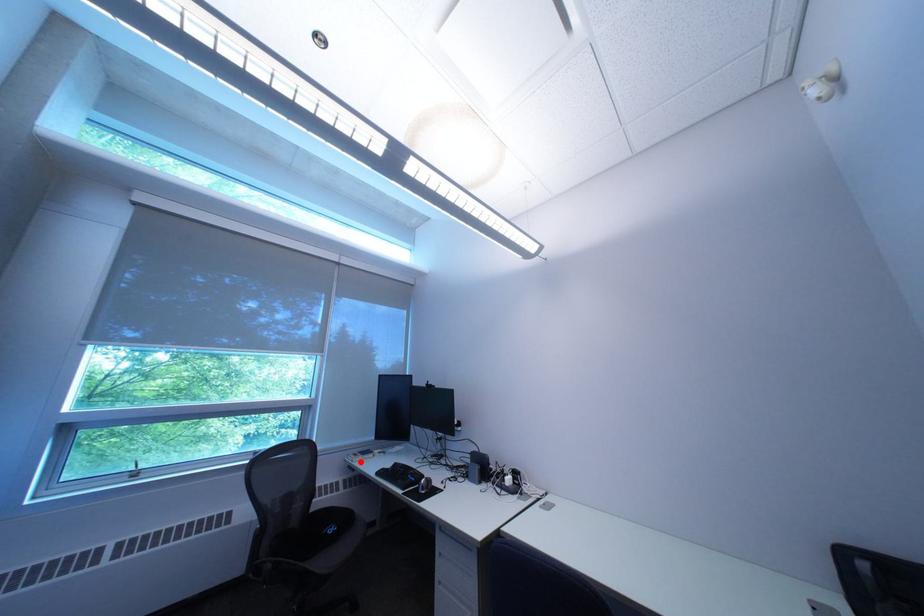
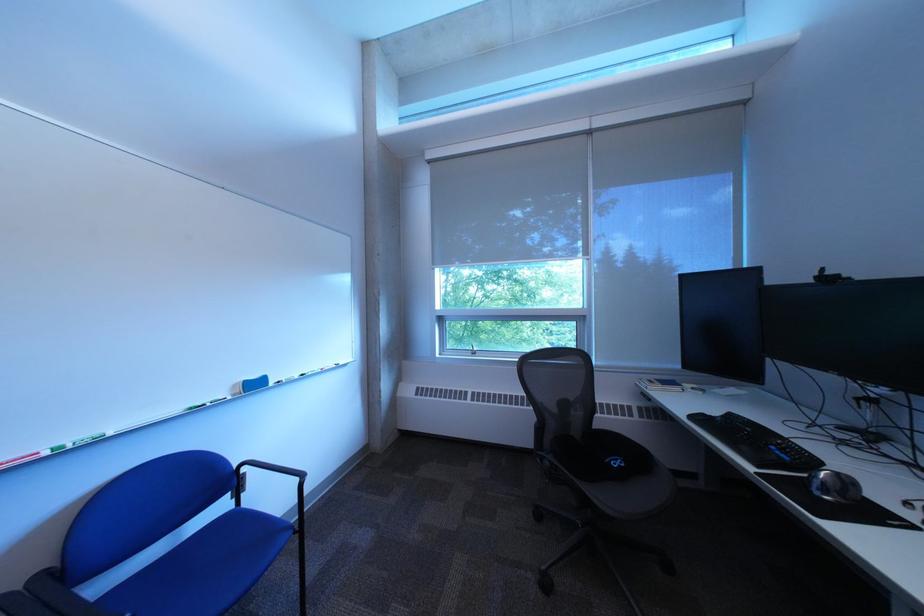
Question: I am providing you with two images of the same scene from different viewpoints. A red point is marked on the first image. Can you still see the location of the red point in image 2?

Choices:
 (A) Yes
 (B) No

Answer: (A)